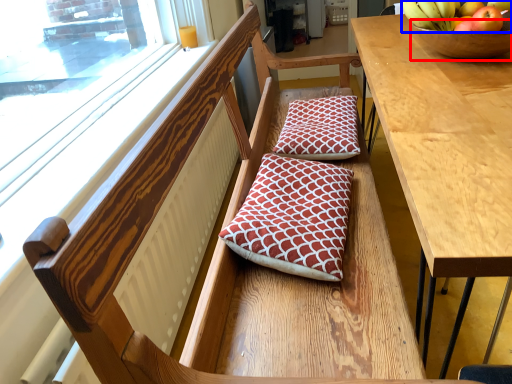
Question: Which object appears closest to the camera in this image, glass bowl (highlighted by a red box) or banana (highlighted by a blue box)?

Choices:
 (A) glass bowl
 (B) banana

Answer: (A)